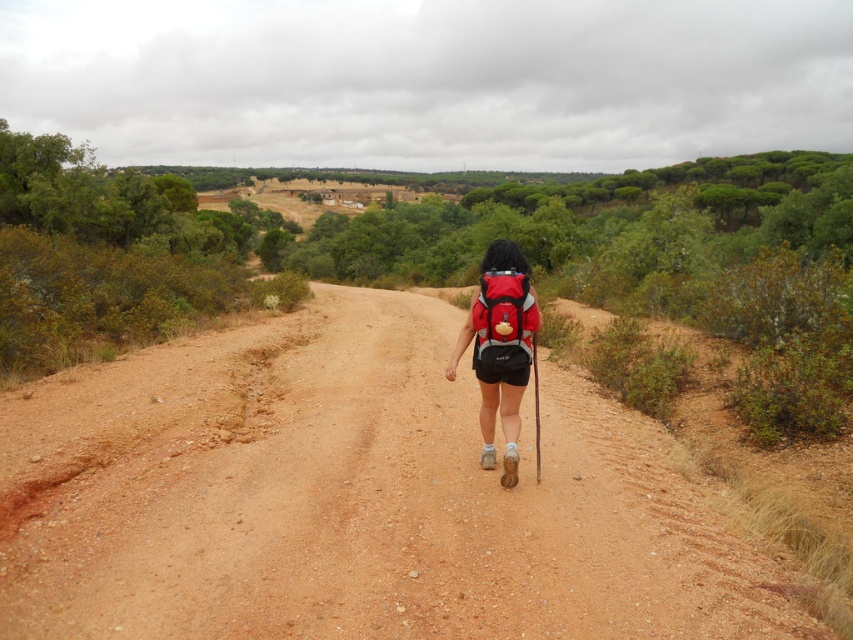
You are a GUI agent. You are given a task and a screenshot of the screen. Output one action in this format:
    pyautogui.click(x=<x>, y=<y>)
    Task: Click on the matte red backpack at center
    The width and height of the screenshot is (853, 640).
    Given the screenshot: What is the action you would take?
    pyautogui.click(x=500, y=348)

Between matte red backpack at center and red fabric backpack at center, which one is positioned higher?

red fabric backpack at center is above.

Is point (498, 243) positioned behind point (512, 316)?

Yes, it is behind point (512, 316).

The height and width of the screenshot is (640, 853). I want to click on matte red backpack at center, so click(500, 348).

Which is in front, point (253, 339) or point (512, 332)?

Point (512, 332) is in front.

Who is positioned more to the left, brown dirt track at center or red fabric backpack at center?

brown dirt track at center is more to the left.

Is point (560, 433) more distant than point (480, 323)?

Yes, it is behind point (480, 323).

You are a GUI agent. You are given a task and a screenshot of the screen. Output one action in this format:
    pyautogui.click(x=<x>, y=<y>)
    Task: Click on the brown dirt track at center
    The width and height of the screenshot is (853, 640).
    Given the screenshot: What is the action you would take?
    pyautogui.click(x=352, y=499)

Is brown dirt track at center positioned before matte red backpack at center?

Yes, it is in front of matte red backpack at center.

Between point (544, 420) and point (494, 256), which one is positioned behind?

The point (544, 420) is behind.

Who is more distant from viewer, (231, 394) or (477, 344)?

The point (231, 394) is behind.

I want to click on brown dirt track at center, so click(x=352, y=499).